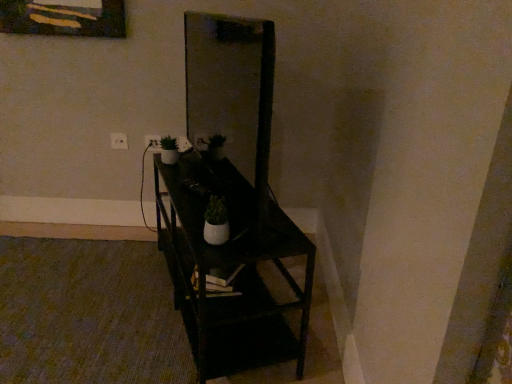
What is the approximate height of black matte shelf at center?

black matte shelf at center is 21.12 inches tall.

Identify the location of white plastic electric outlet at upper left, the 1th electric outlet when ordered from left to right. (119, 141).

Is white plastic electric outlet at upper center, which appears as the 1th electric outlet when viewed from the right, facing away from black matte shelf at center?

That's not correct — white plastic electric outlet at upper center, which appears as the 1th electric outlet when viewed from the right, is not looking away from black matte shelf at center.

Between white plastic electric outlet at upper center, the second electric outlet viewed from the left, and black matte shelf at center, which one is positioned behind?

white plastic electric outlet at upper center, the second electric outlet viewed from the left, is more distant.

Between white plastic electric outlet at upper center, which appears as the 1th electric outlet when viewed from the right, and black matte shelf at center, which one has less height?

white plastic electric outlet at upper center, which appears as the 1th electric outlet when viewed from the right.

Which point is more forward, (145, 135) or (253, 296)?

The point (253, 296) is closer.

From a real-world perspective, who is located higher, matte glass mirror at center or black matte shelf at center?

In real-world perspective, matte glass mirror at center is above.

What's the angular difference between matte glass mirror at center and black matte shelf at center's facing directions?

The angular difference between matte glass mirror at center and black matte shelf at center is 0.0112 degrees.

Considering the sizes of objects matte glass mirror at center and black matte shelf at center in the image provided, who is taller, matte glass mirror at center or black matte shelf at center?

Standing taller between the two is matte glass mirror at center.

In the scene shown: From the image's perspective, is matte glass mirror at center below black matte shelf at center?

No.

Is point (153, 137) positioned in front of point (116, 142)?

Yes.

From the image's perspective, would you say white plastic electric outlet at upper center, the second electric outlet viewed from the left, is shown under white plastic electric outlet at upper left, the 2th electric outlet positioned from the right?

Indeed, from the image's perspective, white plastic electric outlet at upper center, the second electric outlet viewed from the left, is shown beneath white plastic electric outlet at upper left, the 2th electric outlet positioned from the right.

Who is taller, white plastic electric outlet at upper center, which appears as the 1th electric outlet when viewed from the right, or white plastic electric outlet at upper left, the 1th electric outlet when ordered from left to right?

white plastic electric outlet at upper left, the 1th electric outlet when ordered from left to right, is taller.

In the scene shown: Considering the relative sizes of white plastic electric outlet at upper center, the second electric outlet viewed from the left, and white plastic electric outlet at upper left, the 2th electric outlet positioned from the right, in the image provided, is white plastic electric outlet at upper center, the second electric outlet viewed from the left, smaller than white plastic electric outlet at upper left, the 2th electric outlet positioned from the right,?

Correct, white plastic electric outlet at upper center, the second electric outlet viewed from the left, occupies less space than white plastic electric outlet at upper left, the 2th electric outlet positioned from the right.

In the image, is white plastic electric outlet at upper left, the 2th electric outlet positioned from the right, on the left side or the right side of white plastic electric outlet at upper center, which appears as the 1th electric outlet when viewed from the right?

From the image, it's evident that white plastic electric outlet at upper left, the 2th electric outlet positioned from the right, is to the left of white plastic electric outlet at upper center, which appears as the 1th electric outlet when viewed from the right.

Looking at this image, choose the correct answer: Is white plastic electric outlet at upper left, the 2th electric outlet positioned from the right, inside white plastic electric outlet at upper center, the second electric outlet viewed from the left, or outside it?

white plastic electric outlet at upper left, the 2th electric outlet positioned from the right, is outside white plastic electric outlet at upper center, the second electric outlet viewed from the left.

Does white plastic electric outlet at upper left, the 1th electric outlet when ordered from left to right, have a smaller size compared to white plastic electric outlet at upper center, the second electric outlet viewed from the left?

Incorrect, white plastic electric outlet at upper left, the 1th electric outlet when ordered from left to right, is not smaller in size than white plastic electric outlet at upper center, the second electric outlet viewed from the left.

Is point (256, 136) less distant than point (155, 136)?

Yes, point (256, 136) is closer to viewer.

Between matte glass mirror at center and white plastic electric outlet at upper center, which appears as the 1th electric outlet when viewed from the right, which one is positioned behind?

white plastic electric outlet at upper center, which appears as the 1th electric outlet when viewed from the right, is more distant.

From a real-world perspective, is matte glass mirror at center above or below white plastic electric outlet at upper center, the second electric outlet viewed from the left?

matte glass mirror at center is situated higher than white plastic electric outlet at upper center, the second electric outlet viewed from the left, in the real world.

Is matte glass mirror at center oriented away from white plastic electric outlet at upper center, which appears as the 1th electric outlet when viewed from the right?

No, white plastic electric outlet at upper center, which appears as the 1th electric outlet when viewed from the right, is not at the back of matte glass mirror at center.

Could you tell me if matte glass mirror at center is turned towards white plastic electric outlet at upper left, the 1th electric outlet when ordered from left to right?

No, matte glass mirror at center is not facing towards white plastic electric outlet at upper left, the 1th electric outlet when ordered from left to right.

From the image's perspective, who appears lower, matte glass mirror at center or white plastic electric outlet at upper left, the 1th electric outlet when ordered from left to right?

white plastic electric outlet at upper left, the 1th electric outlet when ordered from left to right.

Considering the sizes of matte glass mirror at center and white plastic electric outlet at upper left, the 1th electric outlet when ordered from left to right, in the image, is matte glass mirror at center wider or thinner than white plastic electric outlet at upper left, the 1th electric outlet when ordered from left to right,?

matte glass mirror at center is wider than white plastic electric outlet at upper left, the 1th electric outlet when ordered from left to right.

From the image's perspective, is black matte shelf at center located above or below matte glass mirror at center?

Based on their image positions, black matte shelf at center is located beneath matte glass mirror at center.

Looking at this image, is black matte shelf at center turned away from matte glass mirror at center?

No, black matte shelf at center is not facing away from matte glass mirror at center.

Consider the image. Can you tell me how much black matte shelf at center and matte glass mirror at center differ in facing direction?

They differ by 0.0112 degrees in their facing directions.

From a real-world perspective, is black matte shelf at center positioned over matte glass mirror at center based on gravity?

No, from a real-world perspective, black matte shelf at center is not above matte glass mirror at center.

Identify the location of furniture in front of the white plastic electric outlet at upper center, which appears as the 1th electric outlet when viewed from the right. (229, 177).

Image resolution: width=512 pixels, height=384 pixels. Find the location of `furniture behind the matte glass mirror at center`. furniture behind the matte glass mirror at center is located at coordinates (229, 177).

When comparing their distances from black matte shelf at center, does matte glass mirror at center or white plastic electric outlet at upper left, the 2th electric outlet positioned from the right, seem closer?

matte glass mirror at center is positioned closer to the anchor black matte shelf at center.

Based on their spatial positions, is white plastic electric outlet at upper left, the 1th electric outlet when ordered from left to right, or white plastic electric outlet at upper center, which appears as the 1th electric outlet when viewed from the right, closer to black matte shelf at center?

Based on the image, white plastic electric outlet at upper center, which appears as the 1th electric outlet when viewed from the right, appears to be nearer to black matte shelf at center.

Looking at the image, which one is located closer to black matte shelf at center, matte glass mirror at center or white plastic electric outlet at upper center, which appears as the 1th electric outlet when viewed from the right?

The object closer to black matte shelf at center is matte glass mirror at center.

When comparing their distances from white plastic electric outlet at upper center, which appears as the 1th electric outlet when viewed from the right, does white plastic electric outlet at upper left, the 1th electric outlet when ordered from left to right, or black matte shelf at center seem closer?

white plastic electric outlet at upper left, the 1th electric outlet when ordered from left to right, lies closer to white plastic electric outlet at upper center, which appears as the 1th electric outlet when viewed from the right, than the other object.

From the image, which object appears to be nearer to matte glass mirror at center, white plastic electric outlet at upper center, which appears as the 1th electric outlet when viewed from the right, or black matte shelf at center?

white plastic electric outlet at upper center, which appears as the 1th electric outlet when viewed from the right, is positioned closer to the anchor matte glass mirror at center.

Estimate the real-world distances between objects in this image. Which object is further from matte glass mirror at center, black matte shelf at center or white plastic electric outlet at upper left, the 2th electric outlet positioned from the right?

Based on the image, black matte shelf at center appears to be further to matte glass mirror at center.

Based on their spatial positions, is black matte shelf at center or white plastic electric outlet at upper center, the second electric outlet viewed from the left, closer to matte glass mirror at center?

white plastic electric outlet at upper center, the second electric outlet viewed from the left, is positioned closer to the anchor matte glass mirror at center.

Looking at the image, which one is located closer to white plastic electric outlet at upper left, the 2th electric outlet positioned from the right, black matte shelf at center or white plastic electric outlet at upper center, the second electric outlet viewed from the left?

white plastic electric outlet at upper center, the second electric outlet viewed from the left, is closer to white plastic electric outlet at upper left, the 2th electric outlet positioned from the right.

The height and width of the screenshot is (384, 512). I want to click on electric outlet between black matte shelf at center and white plastic electric outlet at upper left, the 2th electric outlet positioned from the right, from front to back, so click(153, 142).

Identify the location of electric outlet between matte glass mirror at center and white plastic electric outlet at upper left, the 2th electric outlet positioned from the right, from front to back. The image size is (512, 384). (153, 142).

At what (x,y) coordinates should I click in order to perform the action: click on furniture located between matte glass mirror at center and white plastic electric outlet at upper left, the 1th electric outlet when ordered from left to right, in the depth direction. Please return your answer as a coordinate pair (x, y). Image resolution: width=512 pixels, height=384 pixels. Looking at the image, I should click on (229, 177).

This screenshot has width=512, height=384. What are the coordinates of `furniture located between matte glass mirror at center and white plastic electric outlet at upper center, which appears as the 1th electric outlet when viewed from the right, in the depth direction` in the screenshot? It's located at (229, 177).